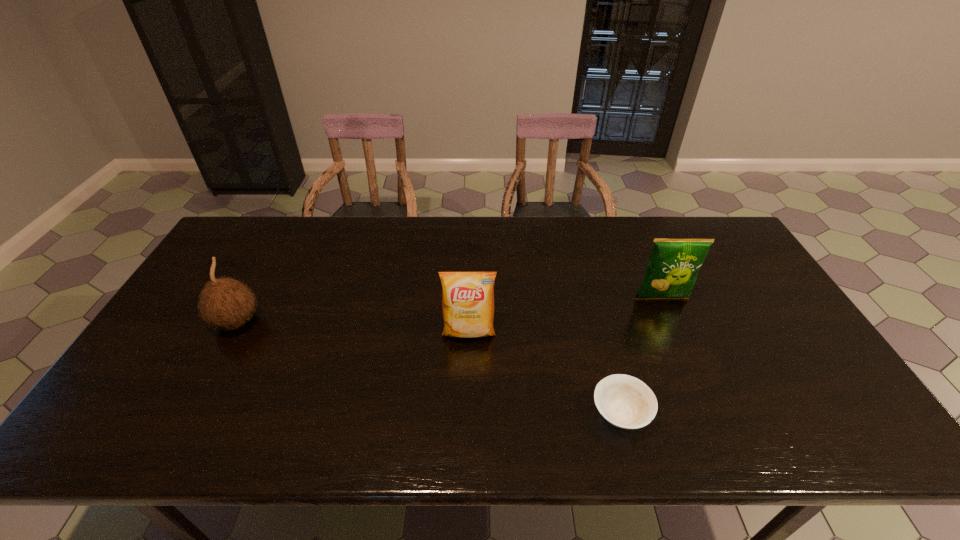
The image size is (960, 540). Find the location of `free spot that satisfies the following two spatial constraints: 1. on the back side of the third object from left to right; 2. on the surface of the leftmost object`. free spot that satisfies the following two spatial constraints: 1. on the back side of the third object from left to right; 2. on the surface of the leftmost object is located at coordinates (597, 322).

At what (x,y) coordinates should I click in order to perform the action: click on free location that satisfies the following two spatial constraints: 1. on the front-facing side of the nearest object; 2. on the right side of the third object from right to left. Please return your answer as a coordinate pair (x, y). This screenshot has width=960, height=540. Looking at the image, I should click on (467, 413).

Locate an element on the screen. The height and width of the screenshot is (540, 960). free space that satisfies the following two spatial constraints: 1. on the front-facing side of the rightmost object; 2. on the surface of the coconut is located at coordinates (672, 322).

Image resolution: width=960 pixels, height=540 pixels. What are the coordinates of `free region that satisfies the following two spatial constraints: 1. on the surface of the third object from left to right; 2. on the left side of the coconut` in the screenshot? It's located at (186, 413).